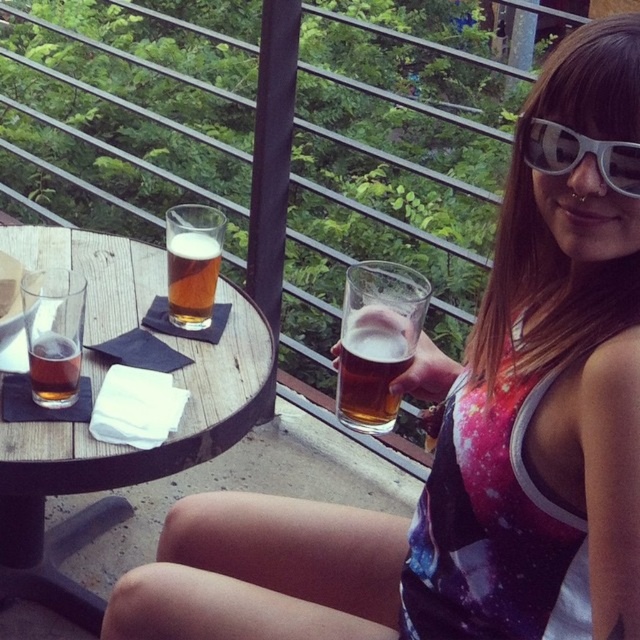
You are standing at the center of the image and want to place a new object at the same location as the woodenobject at left. What coordinates should you use?

The woodenobject at left is located at coordinates point (x=122, y=461), so you should place the new object at point (x=122, y=461).

You are a bartender who needs to place a new drink between the translucent glass beer at center and the amber glass beer at center. The new drink requires 12 inches of space. Is there enough space between them?

The distance between the translucent glass beer at center and the amber glass beer at center is 13.34 inches, which is more than the required 12 inches. Therefore, there is enough space to place the new drink between them.